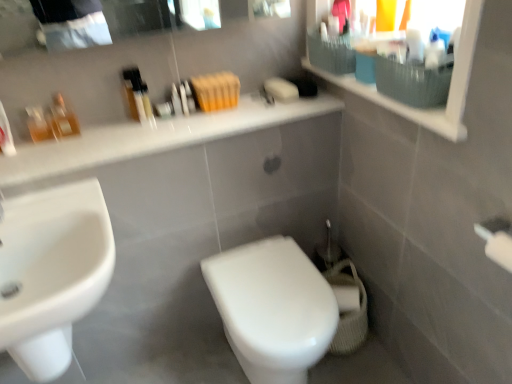
Locate an element on the screen. vacant area on top of white glossy toilet at center (from a real-world perspective) is located at coordinates (268, 283).